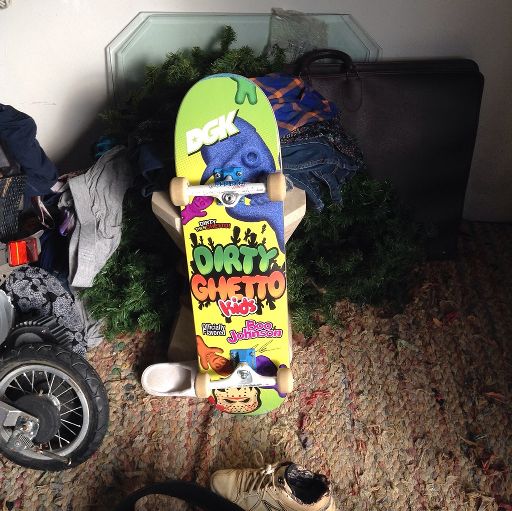
Find the location of a particular element. The height and width of the screenshot is (511, 512). wall is located at coordinates (45, 69), (415, 31).